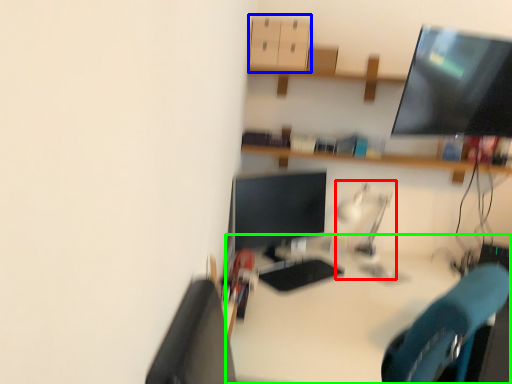
Question: Which object is the farthest from table lamp (highlighted by a red box)? Choose among these: drawer (highlighted by a blue box) or desk (highlighted by a green box).

Choices:
 (A) drawer
 (B) desk

Answer: (A)